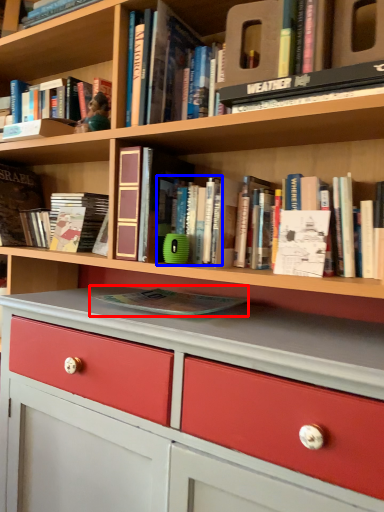
Question: Which object appears closest to the camera in this image, book (highlighted by a red box) or book (highlighted by a blue box)?

Choices:
 (A) book
 (B) book

Answer: (A)